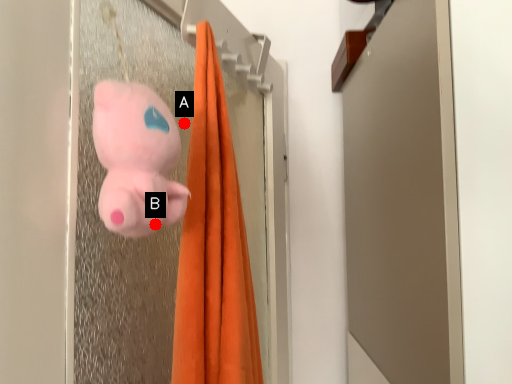
Question: Two points are circled on the image, labeled by A and B beside each circle. Which point is closer to the camera?

Choices:
 (A) A is closer
 (B) B is closer

Answer: (B)